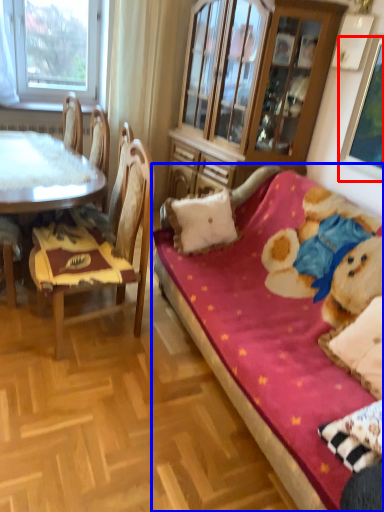
Question: Among these objects, which one is farthest to the camera, picture frame (highlighted by a red box) or studio couch (highlighted by a blue box)?

Choices:
 (A) picture frame
 (B) studio couch

Answer: (A)